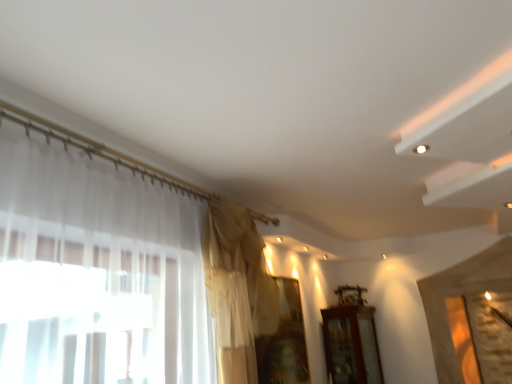
Question: From the image's perspective, is transparent fabric at center located above or below silky beige curtain at upper center?

Choices:
 (A) below
 (B) above

Answer: (A)

Question: Is transparent fabric at center spatially inside silky beige curtain at upper center, or outside of it?

Choices:
 (A) inside
 (B) outside

Answer: (B)

Question: Which is farther from the transparent fabric at center?

Choices:
 (A) silky beige curtain at upper center
 (B) brown wooden cabinet at lower right

Answer: (B)

Question: Considering the real-world distances, which object is closest to the silky beige curtain at upper center?

Choices:
 (A) brown wooden cabinet at lower right
 (B) transparent fabric at center

Answer: (B)